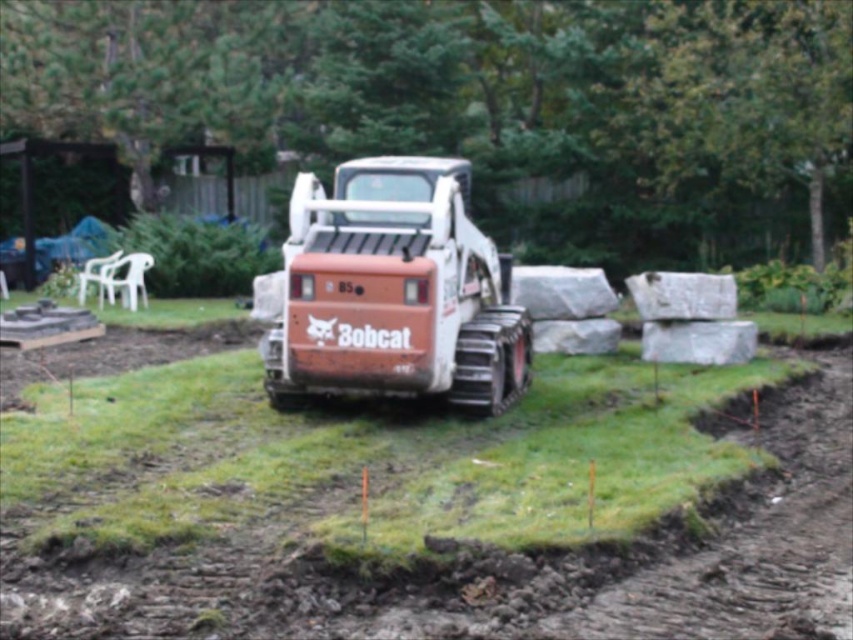
You are a landscape architect designing a garden. You have to place a new statue that requires a base of 2 meters in diameter. Given the scene, can the green grass at center accommodate the statue without overlapping the orange matte bobcat at center?

The green grass at center is larger in size than the orange matte bobcat at center, so there is enough space to place the statue without overlapping the machinery.